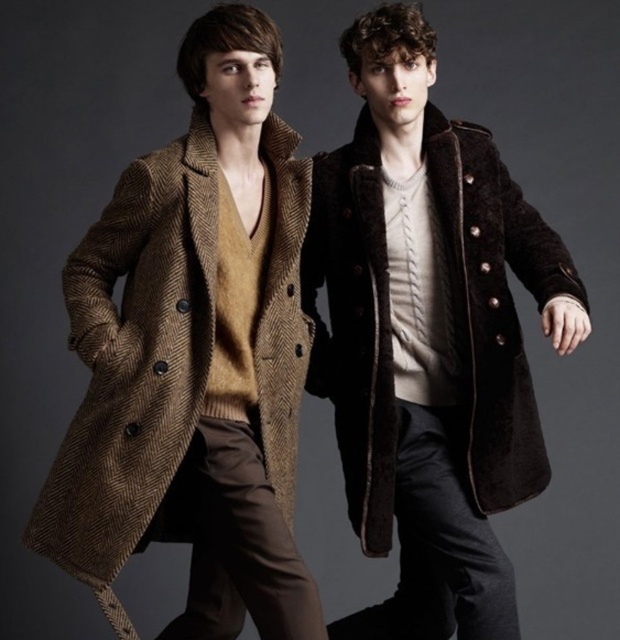
You are a fashion stylist trying to arrange these two coats in a display window for a store. The store requires that the coat on the left should be the one with the herringbone pattern. Based on the image, is the current arrangement of the herringbone wool coat at left and brown woolen coat at center correct?

Yes, the current arrangement is correct because the herringbone wool coat at left is positioned to the left of the brown woolen coat at center, which aligns with the store requirement.

Both the herringbone wool coat at left and the brown woolen coat at center are displayed in the image. Which coat reaches a higher point on the wearer?

The brown woolen coat at center reaches a higher point on the wearer because it is taller than the herringbone wool coat at left.